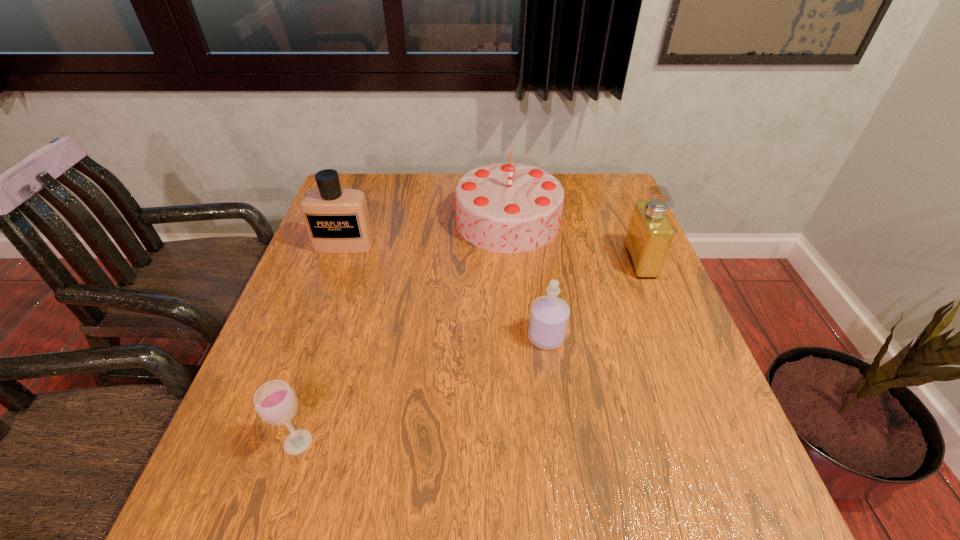
You are a GUI agent. You are given a task and a screenshot of the screen. Output one action in this format:
    pyautogui.click(x=<x>, y=<y>)
    Task: Click on the vacant region located on the front-facing side of the rightmost perfume
    This screenshot has height=540, width=960.
    Given the screenshot: What is the action you would take?
    pyautogui.click(x=503, y=261)

You are a GUI agent. You are given a task and a screenshot of the screen. Output one action in this format:
    pyautogui.click(x=<x>, y=<y>)
    Task: Click on the vacant area situated on the front of the shortest perfume
    This screenshot has width=960, height=540.
    Given the screenshot: What is the action you would take?
    pyautogui.click(x=564, y=468)

Locate an element on the screen. free spot located on the back of the wineglass is located at coordinates (342, 302).

Where is `object positioned at the far edge`? The image size is (960, 540). object positioned at the far edge is located at coordinates (507, 207).

I want to click on perfume that is at the left edge, so click(x=337, y=220).

The image size is (960, 540). I want to click on wineglass present at the left edge, so click(x=275, y=402).

At what (x,y) coordinates should I click in order to perform the action: click on object that is at the right edge. Please return your answer as a coordinate pair (x, y). Looking at the image, I should click on (649, 235).

Image resolution: width=960 pixels, height=540 pixels. What are the coordinates of `blank space at the far edge of the desktop` in the screenshot? It's located at (401, 198).

This screenshot has height=540, width=960. Identify the location of free space at the near edge. (372, 534).

This screenshot has height=540, width=960. In the image, there is a desktop. What are the coordinates of `vacant region at the left edge` in the screenshot? It's located at (303, 474).